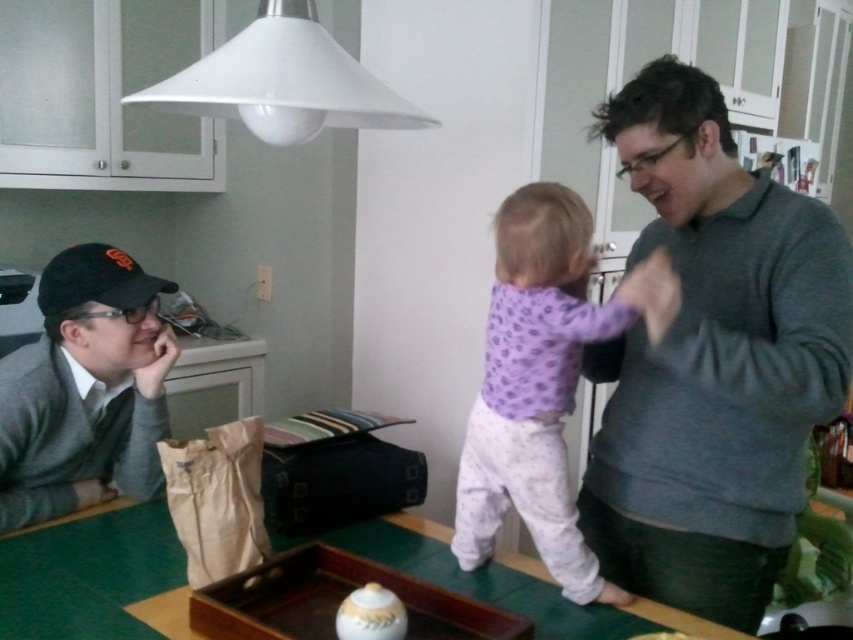
You are standing in the kitchen and want to place a small plant between the two points, point (113, 605) and point (212, 548). Which point should the plant be closer to in order to be closer to the viewer?

The plant should be closer to point (113, 605) because it is closer to the viewer than point (212, 548).

You are a delivery person who needs to place a small package on the table. The package must be placed closer to the purple cotton shirt at center than to the brown paper bag at lower left. Where should you place the package?

Place the package closer to the purple cotton shirt at center since it is already nearer to the viewer compared to the brown paper bag at lower left.